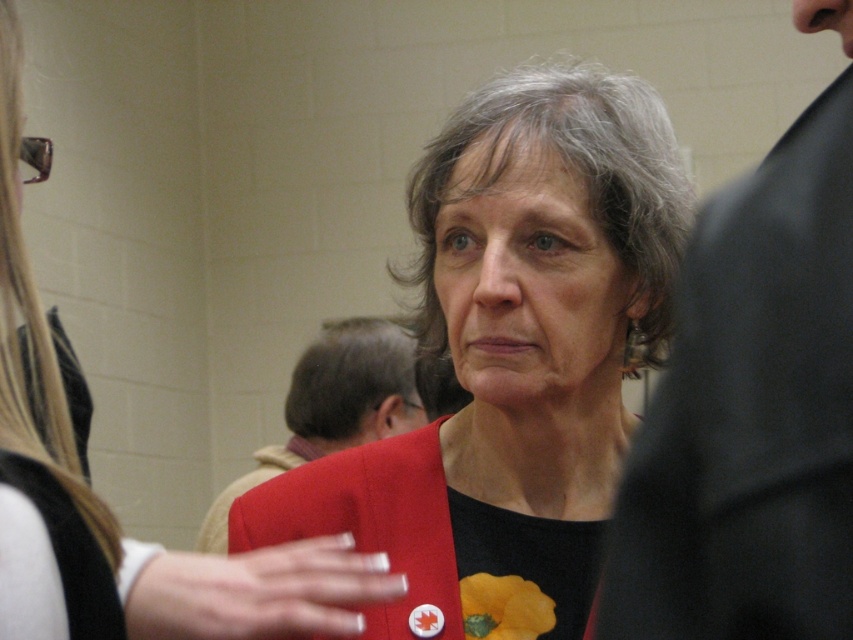
You are a fashion designer analyzing the image. You need to determine which item of clothing is shorter between the matte black suit at right and the matte red coat at center. Which one is shorter?

The matte black suit at right is shorter than the matte red coat at center because the description states that the matte black suit at right is not as tall as the matte red coat at center.

Based on the photo, you are a photographer adjusting the lighting for a portrait. You notice a point at coordinates (514, 360) in the image. Based on the scene description, what object is this point located on?

The point at coordinates (514, 360) is located on the matte red jacket at center.